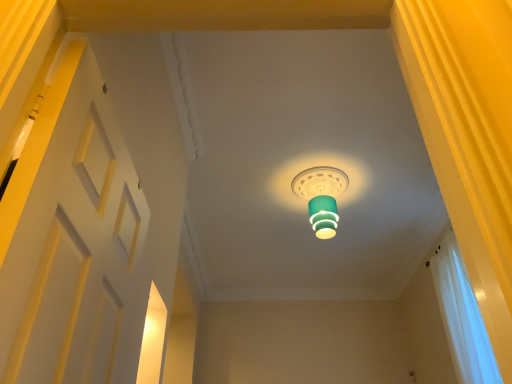
Question: Does white matte door at left lie in front of white sheer curtain at right?

Choices:
 (A) no
 (B) yes

Answer: (B)

Question: Considering the relative sizes of white matte door at left and white sheer curtain at right in the image provided, is white matte door at left taller than white sheer curtain at right?

Choices:
 (A) yes
 (B) no

Answer: (B)

Question: Is white matte door at left not near white sheer curtain at right?

Choices:
 (A) no
 (B) yes

Answer: (B)

Question: From a real-world perspective, does white matte door at left stand above white sheer curtain at right?

Choices:
 (A) yes
 (B) no

Answer: (B)

Question: Is white matte door at left at the right side of white sheer curtain at right?

Choices:
 (A) no
 (B) yes

Answer: (A)

Question: Is teal glossy lampshade at center to the left or to the right of white sheer curtain at right in the image?

Choices:
 (A) left
 (B) right

Answer: (A)

Question: Does point (295, 190) appear closer or farther from the camera than point (490, 367)?

Choices:
 (A) farther
 (B) closer

Answer: (A)

Question: From the image's perspective, is teal glossy lampshade at center above or below white sheer curtain at right?

Choices:
 (A) below
 (B) above

Answer: (B)

Question: Relative to white sheer curtain at right, is teal glossy lampshade at center in front or behind?

Choices:
 (A) front
 (B) behind

Answer: (B)

Question: Choose the correct answer: Is white sheer curtain at right inside white matte door at left or outside it?

Choices:
 (A) outside
 (B) inside

Answer: (A)

Question: From a real-world perspective, is white sheer curtain at right physically located above or below white matte door at left?

Choices:
 (A) above
 (B) below

Answer: (A)

Question: Considering their positions, is white sheer curtain at right located in front of or behind white matte door at left?

Choices:
 (A) front
 (B) behind

Answer: (B)

Question: From their relative heights in the image, would you say white sheer curtain at right is taller or shorter than white matte door at left?

Choices:
 (A) short
 (B) tall

Answer: (B)

Question: Considering their positions, is white matte door at left located in front of or behind white sheer curtain at right?

Choices:
 (A) behind
 (B) front

Answer: (B)

Question: Based on their sizes in the image, would you say white matte door at left is bigger or smaller than white sheer curtain at right?

Choices:
 (A) big
 (B) small

Answer: (B)